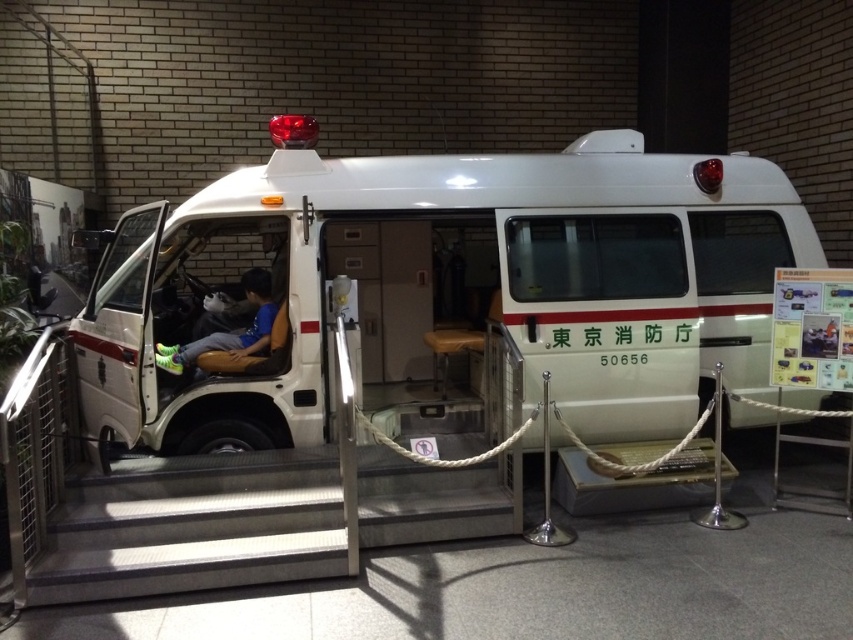
Question: Does white glossy van at center have a greater width compared to metallic silver stairs at center?

Choices:
 (A) no
 (B) yes

Answer: (B)

Question: Does white glossy van at center have a larger size compared to metallic silver stairs at center?

Choices:
 (A) no
 (B) yes

Answer: (B)

Question: Which of the following is the farthest from the observer?

Choices:
 (A) (239, 506)
 (B) (264, 272)
 (C) (624, 145)

Answer: (C)

Question: Among these points, which one is farthest from the camera?

Choices:
 (A) click(x=32, y=605)
 (B) click(x=257, y=285)
 (C) click(x=558, y=397)

Answer: (B)

Question: Which of these objects is positioned farthest from the white glossy van at center?

Choices:
 (A) metallic silver stairs at center
 (B) matte black sneakers at center

Answer: (B)

Question: In this image, where is white glossy van at center located relative to metallic silver stairs at center?

Choices:
 (A) below
 (B) above

Answer: (B)